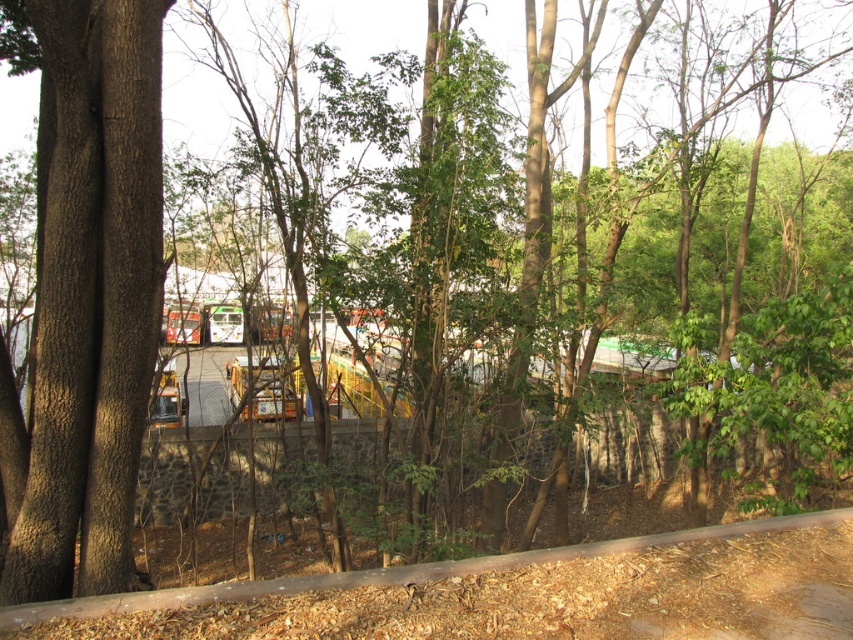
Question: Which point appears closest to the camera in this image?

Choices:
 (A) (233, 596)
 (B) (123, 371)

Answer: (A)

Question: Is brown rough tree trunk at left smaller than brown dirt track at lower center?

Choices:
 (A) no
 (B) yes

Answer: (A)

Question: Is brown rough tree trunk at left to the left of brown dirt track at lower center from the viewer's perspective?

Choices:
 (A) yes
 (B) no

Answer: (A)

Question: Can you confirm if brown rough tree trunk at left is wider than brown dirt track at lower center?

Choices:
 (A) yes
 (B) no

Answer: (B)